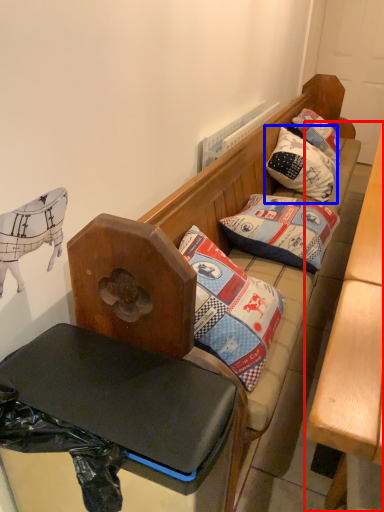
Question: Which object is further to the camera taking this photo, table (highlighted by a red box) or pillow (highlighted by a blue box)?

Choices:
 (A) table
 (B) pillow

Answer: (B)